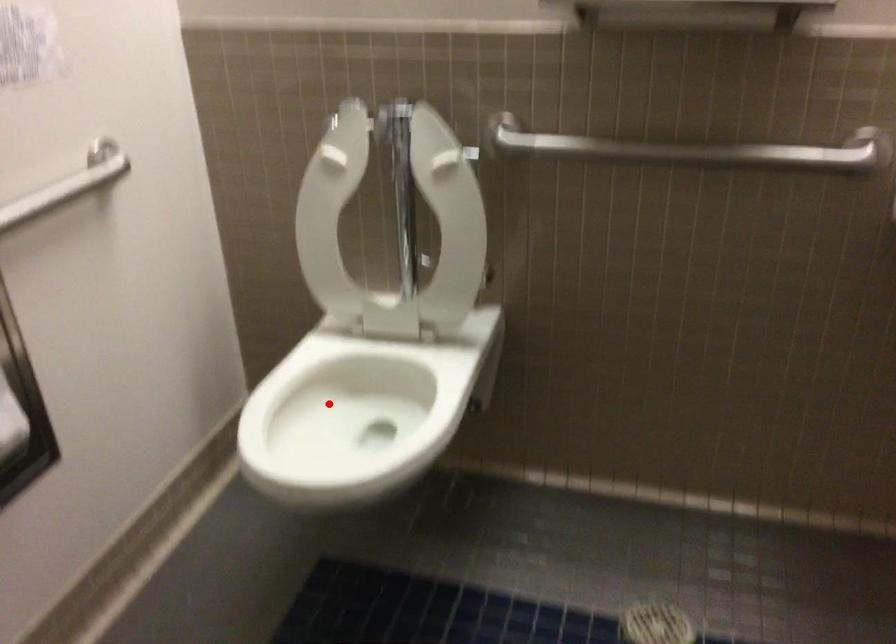
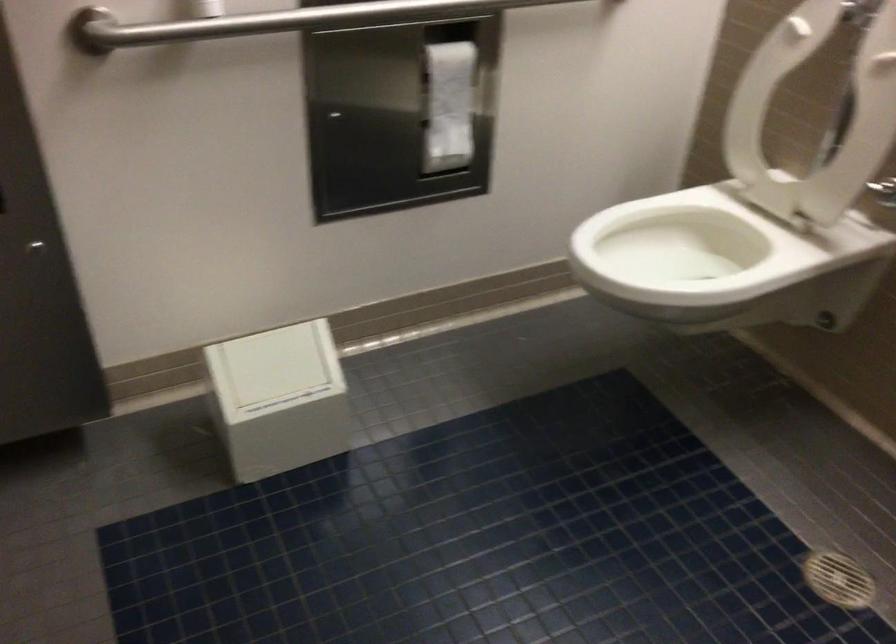
The point at the highlighted location is marked in the first image. Where is the corresponding point in the second image?

(684, 245)